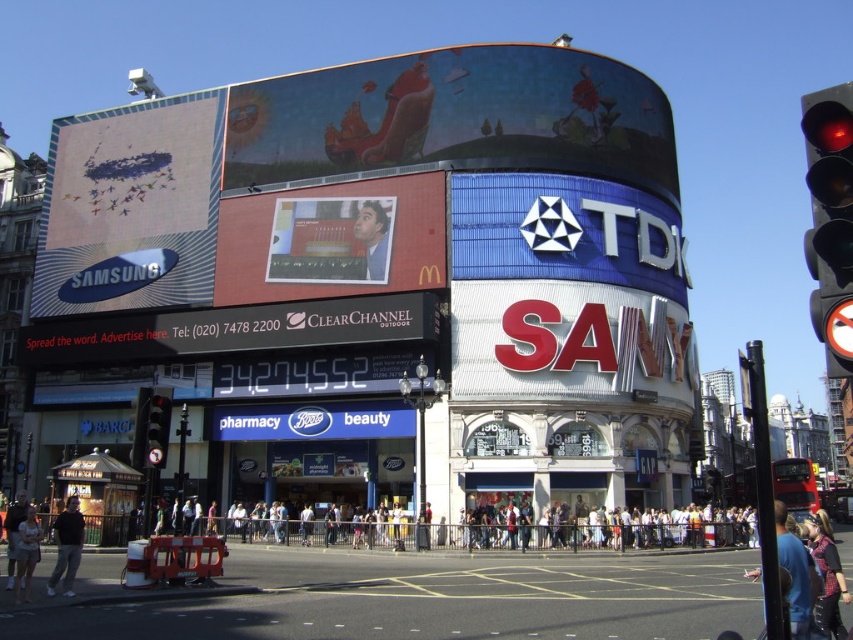
You are standing at the intersection and want to take a photo of the matte white samsung at upper left. If your camera can focus on objects up to 60 meters away, will you need to move closer to get a clear shot?

The matte white samsung at upper left is 61.81 meters from the viewer, so the camera cannot focus on it at this distance. You need to move closer to within 60 meters to ensure a clear photo.

You are standing at the busy intersection and see the curved building with advertisements. There is a point marked at coordinates (x=453, y=120). What color is the sky at that point?

The point (x=453, y=120) corresponds to the matte blue sky at upper center, so the color is blue.